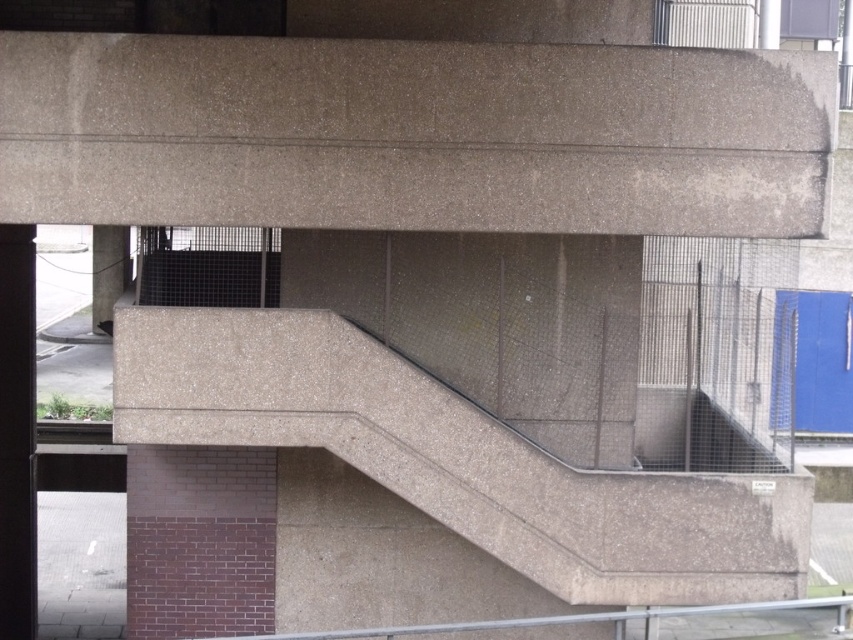
Does black glossy pillar at left appear on the right side of concrete pillar at lower left?

Answer: Indeed, black glossy pillar at left is positioned on the right side of concrete pillar at lower left.

Is black glossy pillar at left closer to camera compared to concrete pillar at lower left?

No.

Between point (30, 592) and point (113, 230), which one is positioned in front?

Point (30, 592)

Locate an element on the screen. The width and height of the screenshot is (853, 640). black glossy pillar at left is located at coordinates (16, 433).

Based on the photo, is concrete stairwell at center positioned at the back of concrete pillar at lower left?

That is True.

Who is more distant from viewer, [294,500] or [119,248]?

Positioned behind is point [119,248].

You are a GUI agent. You are given a task and a screenshot of the screen. Output one action in this format:
    pyautogui.click(x=<x>, y=<y>)
    Task: Click on the concrete stairwell at center
    This screenshot has width=853, height=640.
    Given the screenshot: What is the action you would take?
    pyautogui.click(x=396, y=493)

Can you confirm if concrete stairwell at center is positioned below black glossy pillar at left?

No.

Image resolution: width=853 pixels, height=640 pixels. Describe the element at coordinates (396, 493) in the screenshot. I see `concrete stairwell at center` at that location.

Identify the location of concrete stairwell at center. (396, 493).

Where is `concrete stairwell at center`? concrete stairwell at center is located at coordinates (396, 493).